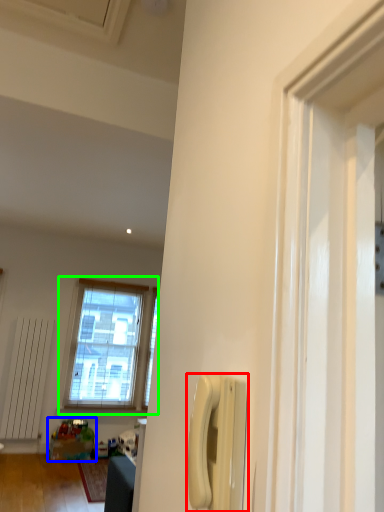
Question: Which object is the closest to the corded phone (highlighted by a red box)? Choose among these: toy (highlighted by a blue box) or window (highlighted by a green box).

Choices:
 (A) toy
 (B) window

Answer: (A)